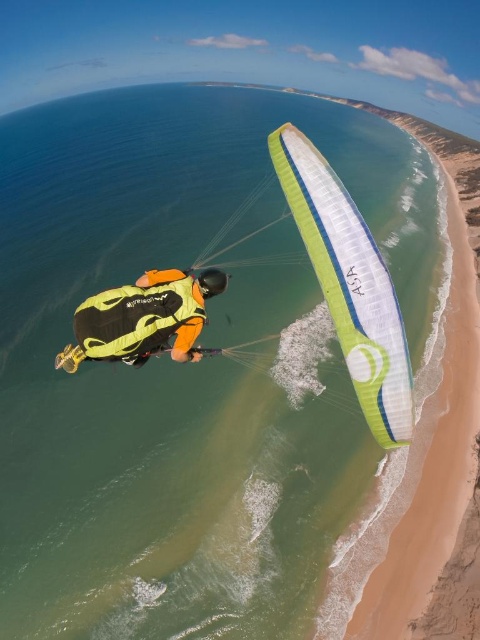
Does green/white fabric parachute at center appear over yellow-green fabric parachute at center?

Indeed, green/white fabric parachute at center is positioned over yellow-green fabric parachute at center.

Is green/white fabric parachute at center shorter than yellow-green fabric parachute at center?

No.

Between point (363, 333) and point (115, 328), which one is positioned behind?

The point (363, 333) is more distant.

Locate an element on the screen. green/white fabric parachute at center is located at coordinates [349, 284].